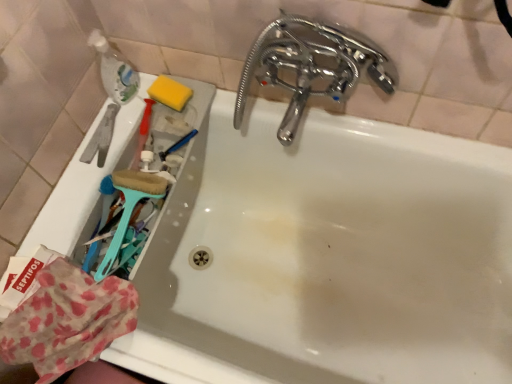
Question: Does teal plastic brush at left come behind polka dot fabric at lower left?

Choices:
 (A) yes
 (B) no

Answer: (A)

Question: Is teal plastic brush at left facing away from polka dot fabric at lower left?

Choices:
 (A) yes
 (B) no

Answer: (B)

Question: Does teal plastic brush at left have a lesser height compared to polka dot fabric at lower left?

Choices:
 (A) yes
 (B) no

Answer: (B)

Question: Is teal plastic brush at left positioned before polka dot fabric at lower left?

Choices:
 (A) no
 (B) yes

Answer: (A)

Question: Is teal plastic brush at left oriented towards polka dot fabric at lower left?

Choices:
 (A) yes
 (B) no

Answer: (B)

Question: Is teal plastic brush at left not close to polka dot fabric at lower left?

Choices:
 (A) no
 (B) yes

Answer: (A)

Question: Is chrome/metallic faucet at upper right to the right of yellow sponge at upper left from the viewer's perspective?

Choices:
 (A) yes
 (B) no

Answer: (A)

Question: From the image's perspective, is chrome/metallic faucet at upper right under yellow sponge at upper left?

Choices:
 (A) yes
 (B) no

Answer: (A)

Question: Can yellow sponge at upper left be found inside chrome/metallic faucet at upper right?

Choices:
 (A) no
 (B) yes

Answer: (A)

Question: Considering the relative sizes of chrome/metallic faucet at upper right and yellow sponge at upper left in the image provided, is chrome/metallic faucet at upper right smaller than yellow sponge at upper left?

Choices:
 (A) no
 (B) yes

Answer: (A)

Question: Is chrome/metallic faucet at upper right taller than yellow sponge at upper left?

Choices:
 (A) yes
 (B) no

Answer: (A)

Question: Can you confirm if chrome/metallic faucet at upper right is shorter than yellow sponge at upper left?

Choices:
 (A) yes
 (B) no

Answer: (B)

Question: Is chrome/metallic faucet at upper right not close to translucent plastic bottle at upper left?

Choices:
 (A) no
 (B) yes

Answer: (A)